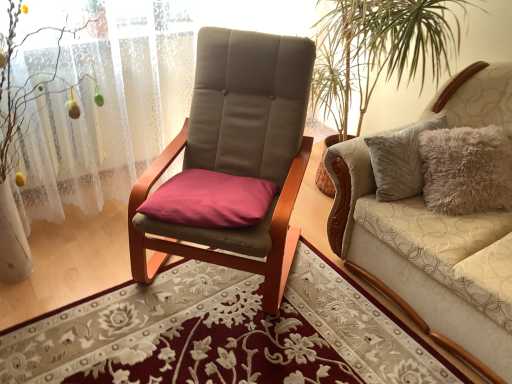
Question: Looking at the image, does beige fabric couch at right seem bigger or smaller compared to white lace curtain at left?

Choices:
 (A) small
 (B) big

Answer: (B)

Question: Considering their positions, is beige fabric couch at right located in front of or behind white lace curtain at left?

Choices:
 (A) front
 (B) behind

Answer: (A)

Question: Based on their positions, is beige fabric couch at right located to the left or right of white lace curtain at left?

Choices:
 (A) right
 (B) left

Answer: (A)

Question: Is white lace curtain at left in front of or behind beige fabric couch at right in the image?

Choices:
 (A) behind
 (B) front

Answer: (A)

Question: From the image's perspective, is white lace curtain at left positioned above or below beige fabric couch at right?

Choices:
 (A) above
 (B) below

Answer: (A)

Question: In terms of height, does white lace curtain at left look taller or shorter compared to beige fabric couch at right?

Choices:
 (A) short
 (B) tall

Answer: (B)

Question: Does point (113, 24) appear closer or farther from the camera than point (500, 114)?

Choices:
 (A) closer
 (B) farther

Answer: (A)